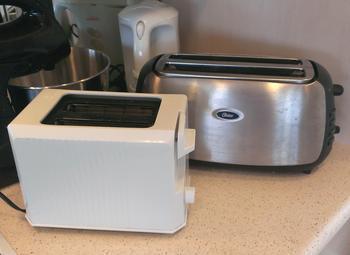
At what (x,y) coordinates should I click in order to perform the action: click on toaster. Please return your answer as a coordinate pair (x, y). The width and height of the screenshot is (350, 255). Looking at the image, I should click on (96, 160).